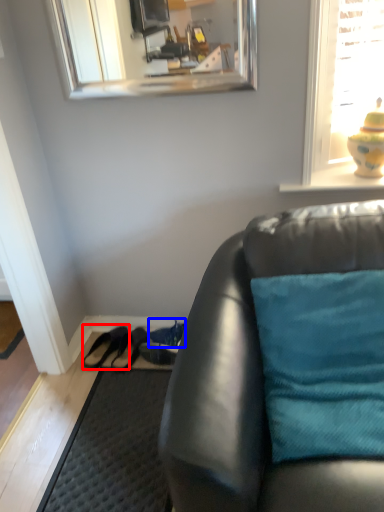
Question: Which object is closer to the camera taking this photo, shoe (highlighted by a red box) or shoe (highlighted by a blue box)?

Choices:
 (A) shoe
 (B) shoe

Answer: (A)